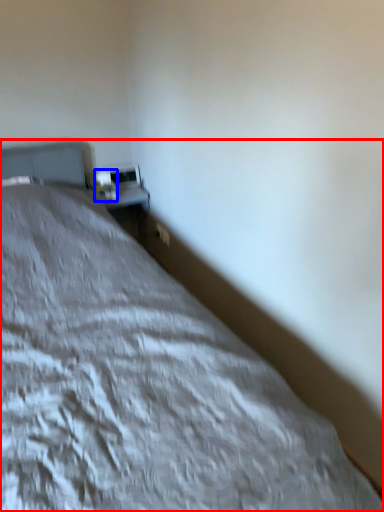
Question: Which object appears closest to the camera in this image, bed (highlighted by a red box) or table lamp (highlighted by a blue box)?

Choices:
 (A) bed
 (B) table lamp

Answer: (A)